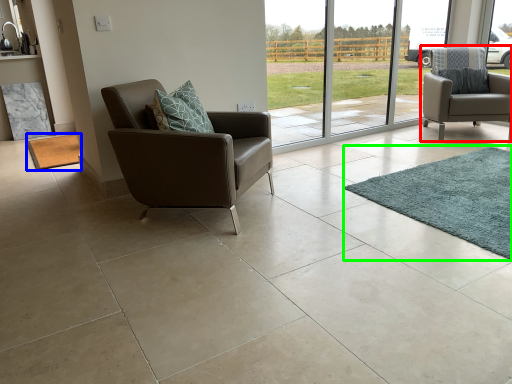
Question: Estimate the real-world distances between objects in this image. Which object is closer to chair (highlighted by a red box), mat (highlighted by a blue box) or mat (highlighted by a green box)?

Choices:
 (A) mat
 (B) mat

Answer: (B)